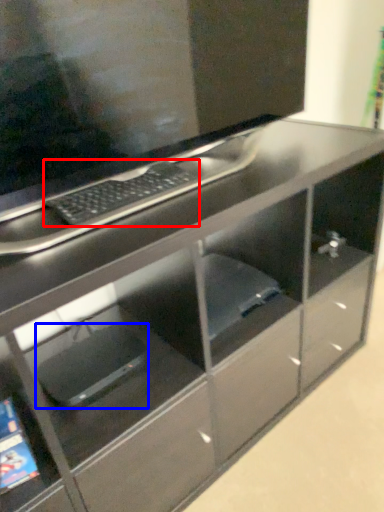
Question: Which object is closer to the camera taking this photo, computer keyboard (highlighted by a red box) or computer (highlighted by a blue box)?

Choices:
 (A) computer keyboard
 (B) computer

Answer: (A)